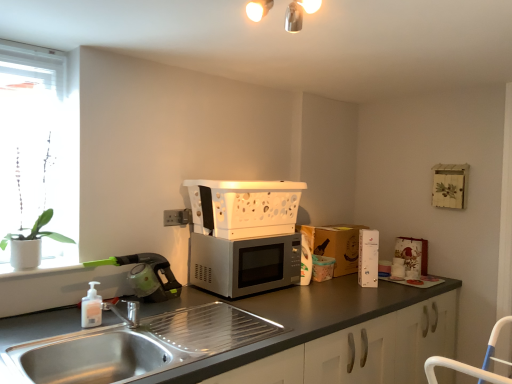
The height and width of the screenshot is (384, 512). I want to click on free location in front of brown cardboard box at right, so [x=354, y=281].